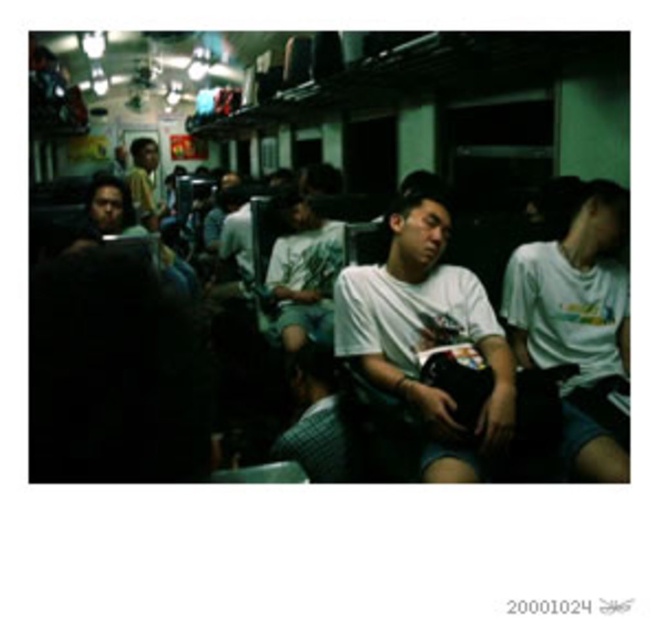
Question: From the image, what is the correct spatial relationship of white matte shirt at center in relation to yellow shirt at upper left?

Choices:
 (A) below
 (B) above

Answer: (A)

Question: Which point appears farthest from the camera in this image?

Choices:
 (A) (150, 225)
 (B) (538, 241)
 (C) (326, 292)

Answer: (A)

Question: In this image, where is white cotton shirt at center located relative to white cotton shirt at right?

Choices:
 (A) above
 (B) below

Answer: (B)

Question: Which object appears closest to the camera in this image?

Choices:
 (A) yellow shirt at upper left
 (B) white matte shirt at center
 (C) white cotton shirt at center

Answer: (C)

Question: Does white matte shirt at center have a greater width compared to yellow shirt at upper left?

Choices:
 (A) no
 (B) yes

Answer: (B)

Question: Which object is positioned closest to the yellow shirt at upper left?

Choices:
 (A) white matte shirt at center
 (B) white cotton shirt at right

Answer: (A)